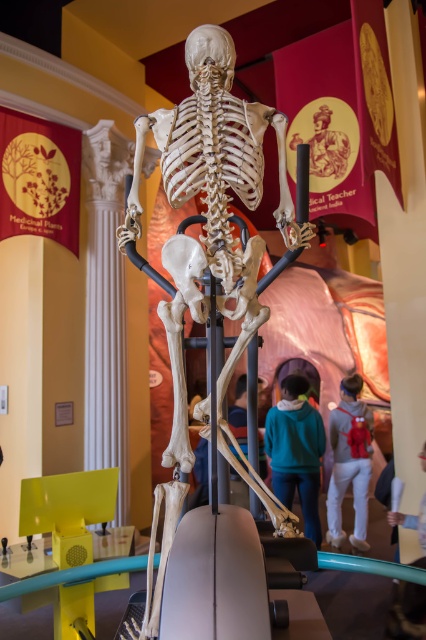
Consider the image. You are a photographer trying to capture both the white bone skeleton at center and the teal hoodie at center in a single frame. Given that your camera has a fixed focal length, which object should you position closer to the camera to ensure both fit within the frame?

Since the white bone skeleton at center is wider than the teal hoodie at center, you should position the wider white bone skeleton at center closer to the camera. This will help both objects fit within the frame as the skeleton takes up more space.

You are a visitor at the museum and want to take a photo of the white bone skeleton at center. The camera you have requires a minimum distance of 1 meter to focus properly. Can you take a clear photo from your current position?

The white bone skeleton at center and viewer are 1.03 meters apart, so yes, you can take a clear photo from your current position because the distance is slightly more than the required 1 meter.

You are a visitor at the museum and want to take a photo of the gray hoodie at center without the white bone skeleton at center blocking the view. Is this possible given their sizes?

The white bone skeleton at center is bigger than the gray hoodie at center, so it would likely block the view of the gray hoodie at center. Therefore, taking a photo of the gray hoodie at center without the white bone skeleton at center blocking the view is not possible.